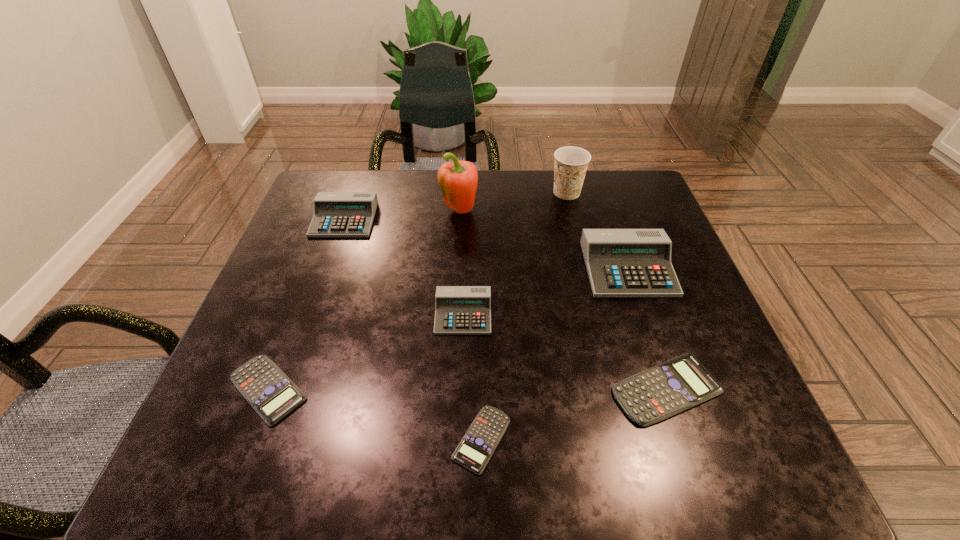
Identify the location of orange pepper. The height and width of the screenshot is (540, 960). (458, 181).

Where is `pepper`? pepper is located at coordinates point(458,181).

Identify the location of Dixie cup. (571, 163).

Where is `orange Dixie cup`? Image resolution: width=960 pixels, height=540 pixels. orange Dixie cup is located at coordinates (571, 163).

The width and height of the screenshot is (960, 540). Find the location of `the third tallest object`. the third tallest object is located at coordinates (620, 262).

Find the location of a particular element. the biggest gray calculator is located at coordinates (620, 262).

Where is `the second smallest gray calculator`? The width and height of the screenshot is (960, 540). the second smallest gray calculator is located at coordinates (336, 214).

Locate an element on the screen. This screenshot has width=960, height=540. the leftmost gray calculator is located at coordinates (336, 214).

The width and height of the screenshot is (960, 540). What are the coordinates of `the fifth tallest object` in the screenshot? It's located at (458, 309).

I want to click on the smallest gray calculator, so click(458, 309).